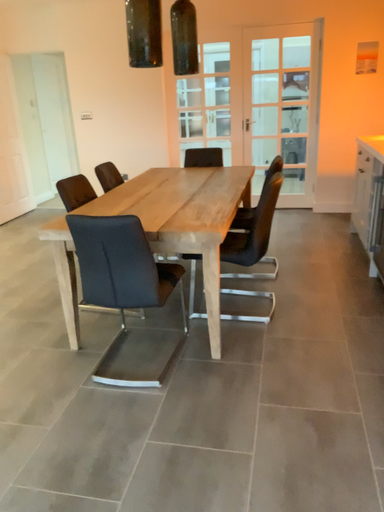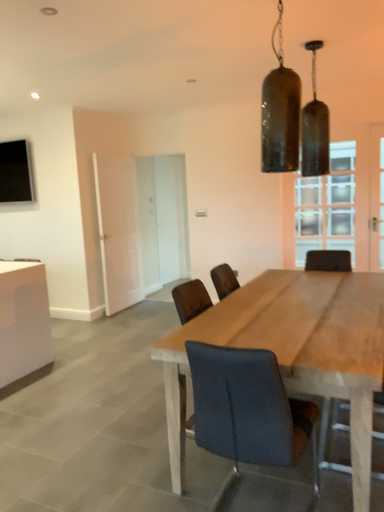
Question: How did the camera likely rotate when shooting the video?

Choices:
 (A) rotated left
 (B) rotated right

Answer: (A)